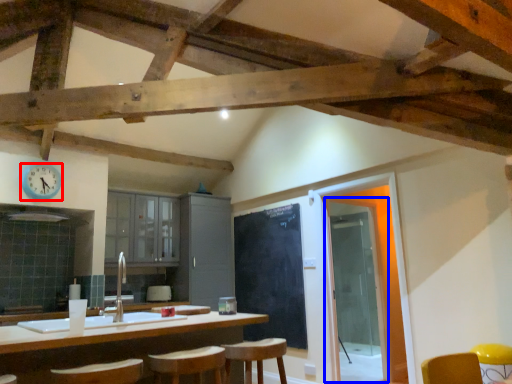
Question: Which of the following is the closest to the observer, clock (highlighted by a red box) or glass door (highlighted by a blue box)?

Choices:
 (A) clock
 (B) glass door

Answer: (A)